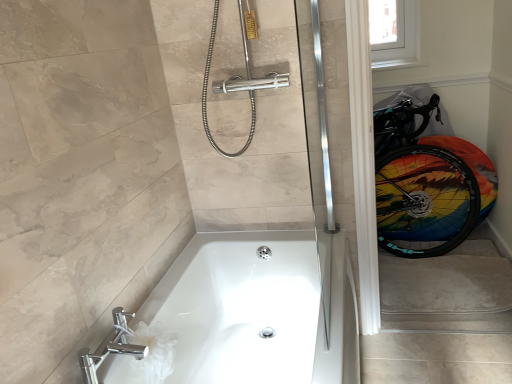
Question: Looking at their shapes, would you say transparent plastic window screen at upper right is wider or thinner than chrome/metallic faucet at lower left?

Choices:
 (A) wide
 (B) thin

Answer: (B)

Question: From the image's perspective, is transparent plastic window screen at upper right located above or below chrome/metallic faucet at lower left?

Choices:
 (A) above
 (B) below

Answer: (A)

Question: Estimate the real-world distances between objects in this image. Which object is farther from the white glossy toilet paper at lower left?

Choices:
 (A) white glossy bathtub at lower center
 (B) transparent plastic window screen at upper right
 (C) rainbow painted tire at right
 (D) chrome/metallic faucet at lower left

Answer: (B)

Question: Estimate the real-world distances between objects in this image. Which object is closer to the rainbow painted tire at right?

Choices:
 (A) transparent plastic window screen at upper right
 (B) white glossy toilet paper at lower left
 (C) white glossy bathtub at lower center
 (D) chrome/metallic faucet at lower left

Answer: (A)